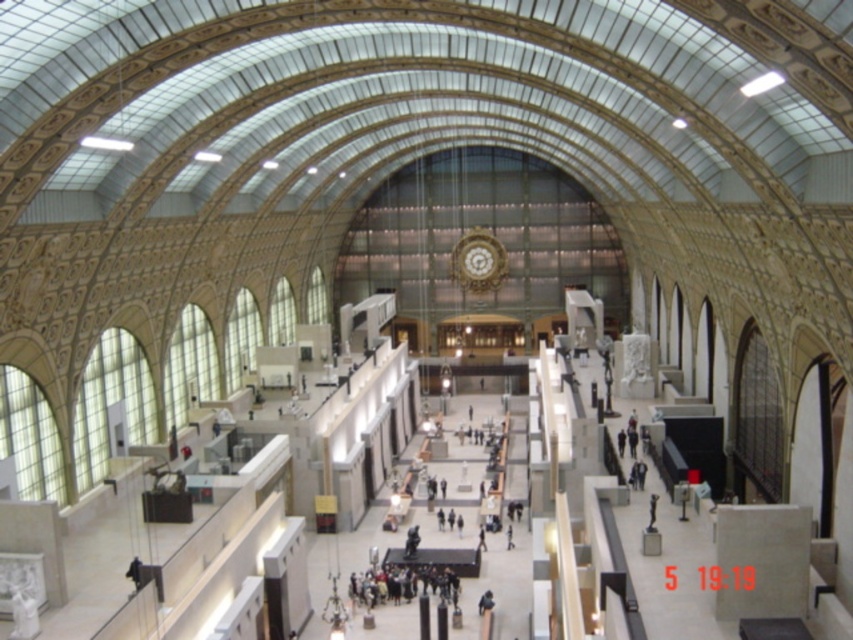
Does point (378, 586) lie behind point (471, 260)?

No, it is not.

Find the location of `dark gray fabric group at center`. dark gray fabric group at center is located at coordinates (403, 582).